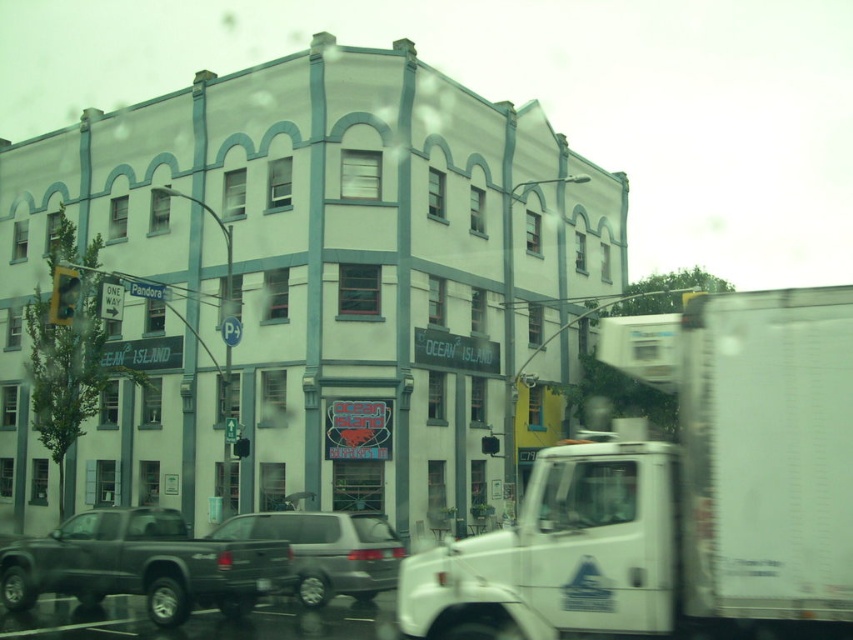
You are a delivery driver who needs to park your truck in a space that can only accommodate vehicles up to the height of the silver metallic suv at center. Based on the scene, can you safely park your matte black truck at lower left in this space?

The matte black truck at lower left has a greater height compared to the silver metallic suv at center. Therefore, the truck cannot be parked in the space since it exceeds the height limit set by the suv.

You are a delivery driver who needs to park your white matte truck at center between two other trucks. The parking spot can only accommodate vehicles shorter than the matte black truck at lower left. Can your truck fit?

The white matte truck at center has a lesser height compared to the matte black truck at lower left, so it is shorter. Therefore, the white matte truck at center can fit in the parking spot designed for vehicles shorter than the matte black truck at lower left.